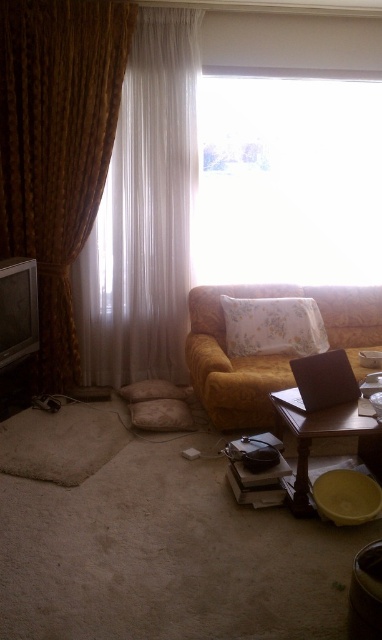
You are arranging a photo shoot in the living room and need to place a model between the gold textured curtain at left and the fluffy white pillow at lower center. Which object should the model stand closer to if they want to be near the left side of the room?

The model should stand closer to the gold textured curtain at left because it is positioned on the left side of the fluffy white pillow at lower center.

You are standing in the living room and want to open the window to let some fresh air in. The transparent glass window at upper center is the only window available. Can you reach the window if you are 5 feet tall?

The transparent glass window at upper center is 12.01 feet from viewer. Since you are 5 feet tall, you cannot reach the window as it is higher than your height.

You are arranging a cozy reading corner in the living room. You have both the floral fabric pillow at center and the fluffy white pillow at lower center. Which pillow should you choose if you want one that is taller to lean against?

The floral fabric pillow at center is taller than the fluffy white pillow at lower center, so you should choose the floral fabric pillow at center for leaning against.